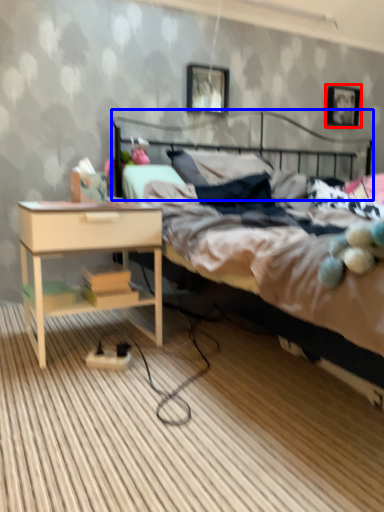
Question: Among these objects, which one is farthest to the camera, picture frame (highlighted by a red box) or headboard (highlighted by a blue box)?

Choices:
 (A) picture frame
 (B) headboard

Answer: (A)